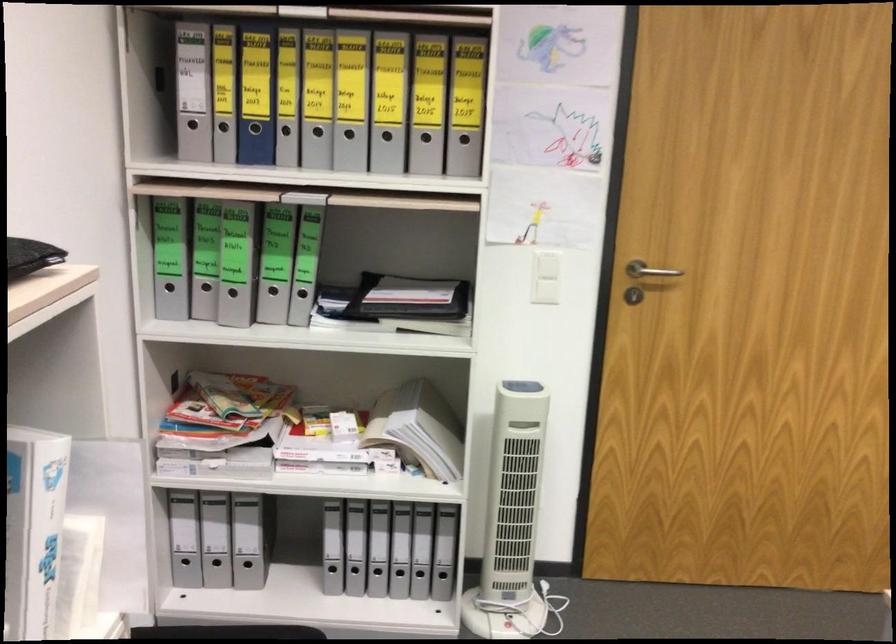
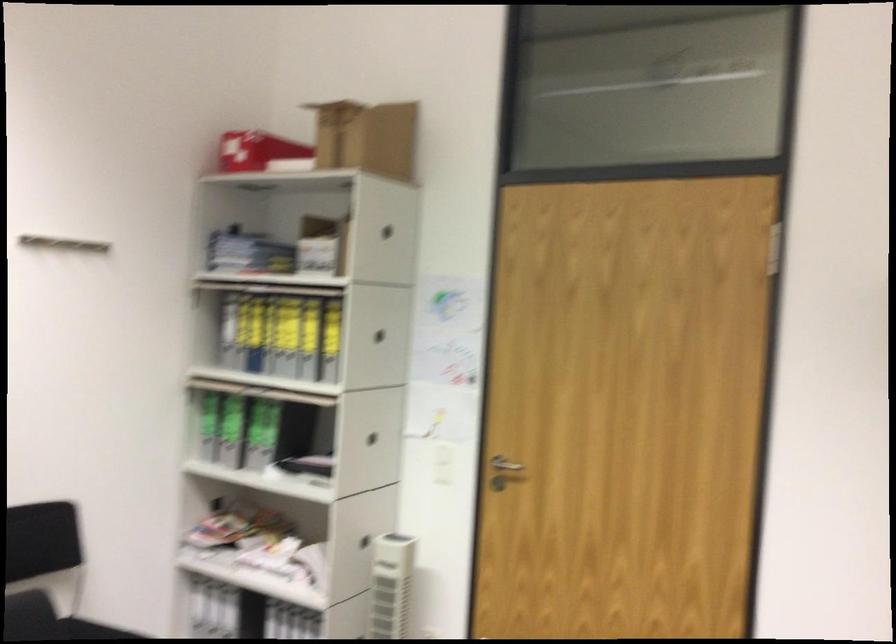
Where in the second image is the point corresponding to [246,146] from the first image?

(248, 361)